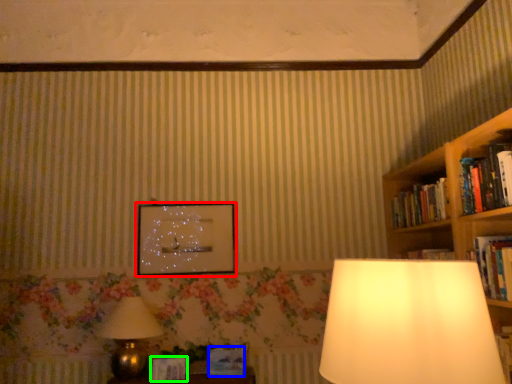
Question: Which is farther away from picture frame (highlighted by a red box)? paperback book (highlighted by a blue box) or paperback book (highlighted by a green box)?

Choices:
 (A) paperback book
 (B) paperback book

Answer: (B)